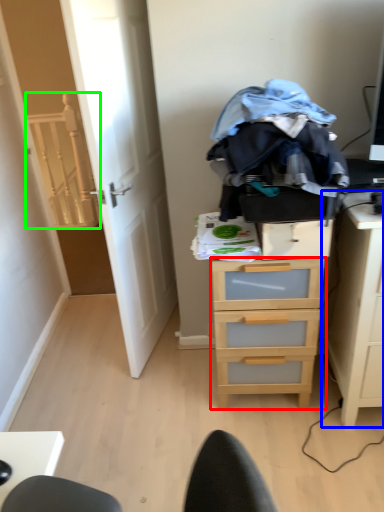
Question: Which is nearer to the chest of drawers (highlighted by a red box)? nightstand (highlighted by a blue box) or stairwell (highlighted by a green box).

Choices:
 (A) nightstand
 (B) stairwell

Answer: (A)